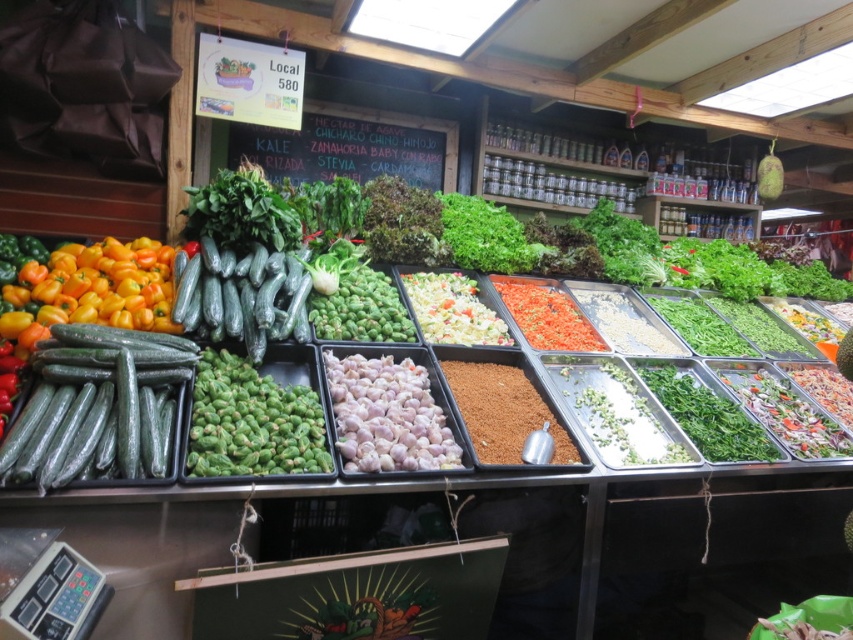
Question: Is green matte cucumbers at center smaller than brown grainy at center?

Choices:
 (A) yes
 (B) no

Answer: (B)

Question: Based on their relative distances, which object is farther from the black chalkboard at upper center?

Choices:
 (A) bright red dried chili flakes at center
 (B) green matte cucumbers at center
 (C) white matte garlic at center

Answer: (B)

Question: Among these objects, which one is nearest to the camera?

Choices:
 (A) white matte garlic at center
 (B) green matte cucumbers at center
 (C) brown grainy at center
 (D) white crumbly at center

Answer: (B)

Question: Does green matte cucumbers at center lie in front of black chalkboard at upper center?

Choices:
 (A) no
 (B) yes

Answer: (B)

Question: Is black chalkboard at upper center smaller than white matte garlic at center?

Choices:
 (A) no
 (B) yes

Answer: (A)

Question: Which point is farther from the camera taking this photo?

Choices:
 (A) (308, 413)
 (B) (292, 160)
 (C) (426, 337)
 (D) (521, 308)

Answer: (B)